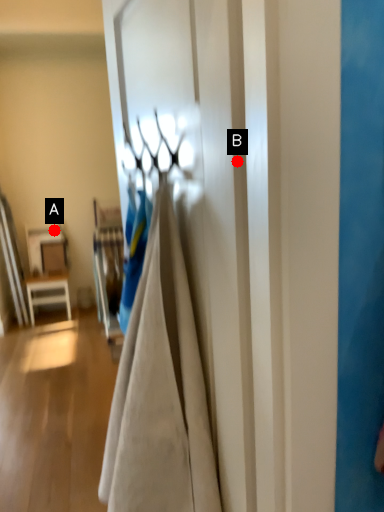
Question: Two points are circled on the image, labeled by A and B beside each circle. Which of the following is the closest to the observer?

Choices:
 (A) A is closer
 (B) B is closer

Answer: (B)